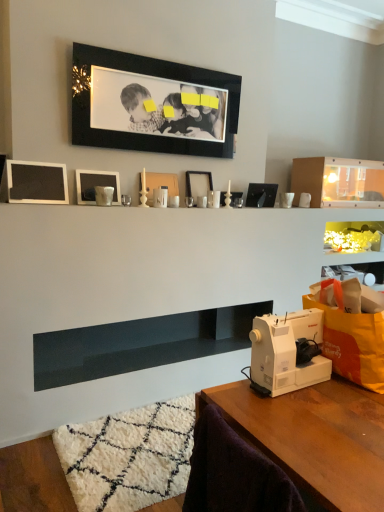
Question: Is smooth dark blue shelf at center, the 2th shelf viewed from the top, thinner than matte black picture frame at center, positioned as the 2th picture frame in right-to-left order?

Choices:
 (A) yes
 (B) no

Answer: (B)

Question: Would you say matte black picture frame at center, marked as the fifth picture frame in a left-to-right arrangement, is part of smooth dark blue shelf at center, the 2th shelf viewed from the top,'s contents?

Choices:
 (A) yes
 (B) no

Answer: (B)

Question: Considering the relative sizes of smooth dark blue shelf at center, the 2th shelf viewed from the top, and matte black picture frame at center, positioned as the 2th picture frame in right-to-left order, in the image provided, is smooth dark blue shelf at center, the 2th shelf viewed from the top, smaller than matte black picture frame at center, positioned as the 2th picture frame in right-to-left order,?

Choices:
 (A) no
 (B) yes

Answer: (A)

Question: Does smooth dark blue shelf at center, the 2th shelf viewed from the top, have a larger size compared to matte black picture frame at center, marked as the fifth picture frame in a left-to-right arrangement?

Choices:
 (A) yes
 (B) no

Answer: (A)

Question: Is smooth dark blue shelf at center, the 2th shelf viewed from the top, not near matte black picture frame at center, positioned as the 2th picture frame in right-to-left order?

Choices:
 (A) yes
 (B) no

Answer: (A)

Question: From a real-world perspective, is smooth dark blue shelf at center, placed as the first shelf when sorted from left to right, positioned under matte black picture frame at center, marked as the fifth picture frame in a left-to-right arrangement, based on gravity?

Choices:
 (A) yes
 (B) no

Answer: (A)

Question: From a real-world perspective, is black matte picture frame at upper center, arranged as the fourth picture frame when viewed from the left, positioned under matte black picture frame at center, which is the 1th picture frame from right to left, based on gravity?

Choices:
 (A) no
 (B) yes

Answer: (A)

Question: Considering the relative sizes of black matte picture frame at upper center, the 3th picture frame positioned from the right, and matte black picture frame at center, which is counted as the sixth picture frame, starting from the left, in the image provided, is black matte picture frame at upper center, the 3th picture frame positioned from the right, shorter than matte black picture frame at center, which is counted as the sixth picture frame, starting from the left,?

Choices:
 (A) yes
 (B) no

Answer: (B)

Question: Is matte black picture frame at center, which is the 1th picture frame from right to left, located within black matte picture frame at upper center, the 3th picture frame positioned from the right?

Choices:
 (A) yes
 (B) no

Answer: (B)

Question: Can you confirm if black matte picture frame at upper center, the 3th picture frame positioned from the right, is taller than matte black picture frame at center, which is counted as the sixth picture frame, starting from the left?

Choices:
 (A) no
 (B) yes

Answer: (B)

Question: Is black matte picture frame at upper center, arranged as the fourth picture frame when viewed from the left, wider than matte black picture frame at center, which is counted as the sixth picture frame, starting from the left?

Choices:
 (A) no
 (B) yes

Answer: (A)

Question: Is the depth of black matte picture frame at upper center, the 3th picture frame positioned from the right, less than that of matte black picture frame at center, which is the 1th picture frame from right to left?

Choices:
 (A) no
 (B) yes

Answer: (B)

Question: Is matte black picture frame at center, positioned as the 2th picture frame in right-to-left order, closer to the viewer compared to white plastic sewing machine at lower right?

Choices:
 (A) no
 (B) yes

Answer: (A)